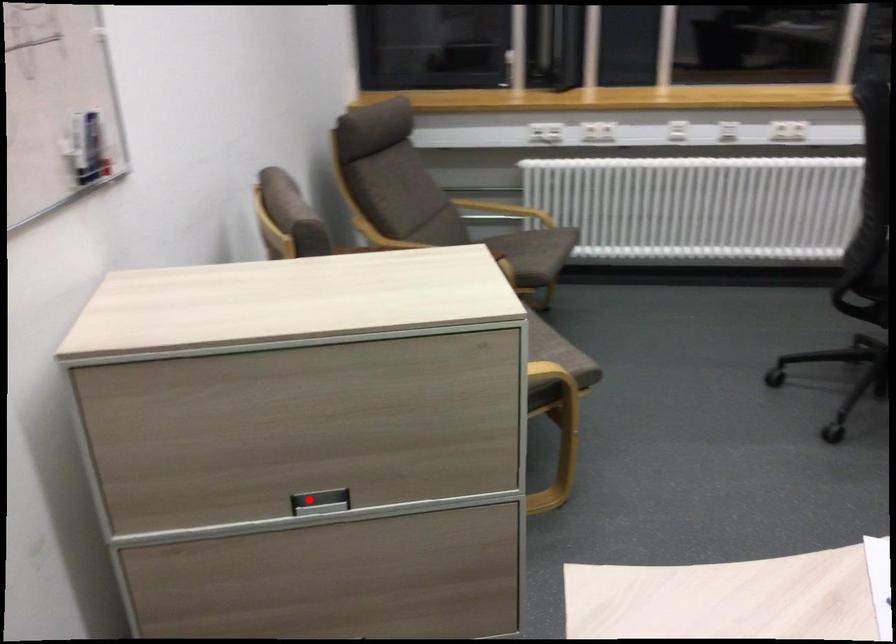
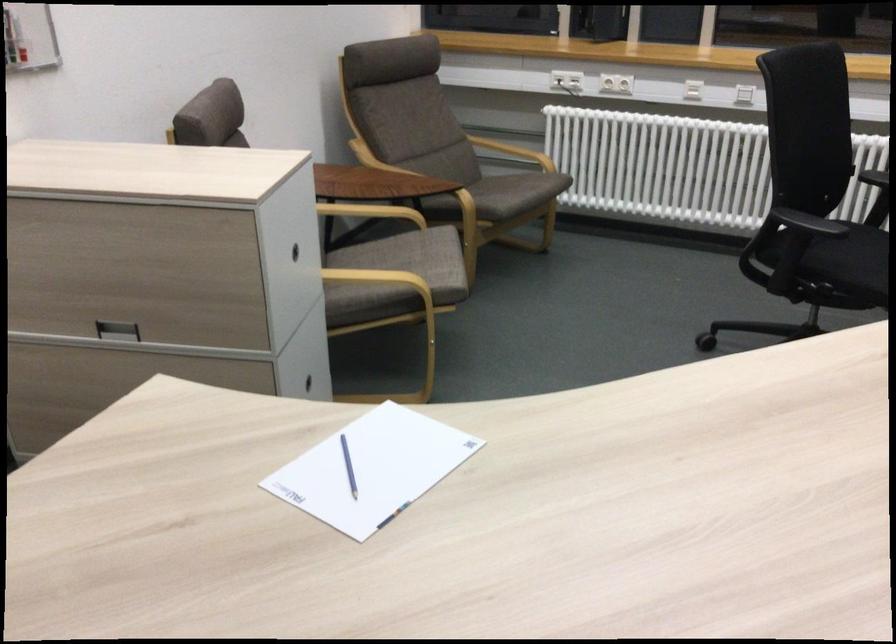
Question: I am providing you with two images of the same scene from different viewpoints. Given a red point in image1, look at the same physical point in image2. Is it:

Choices:
 (A) Closer to the viewpoint
 (B) Farther from the viewpoint

Answer: (B)